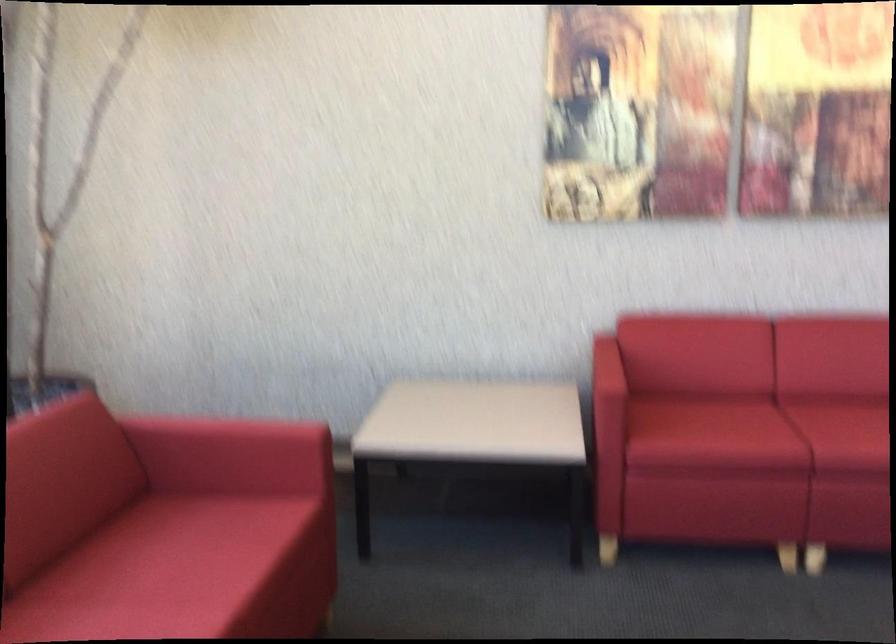
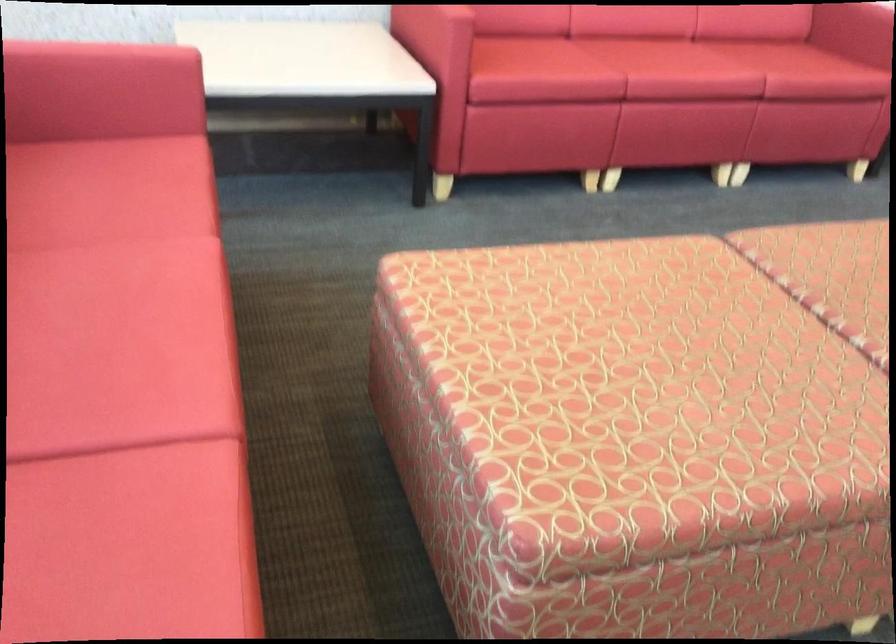
The point at (246, 430) is marked in the first image. Where is the corresponding point in the second image?

(102, 53)